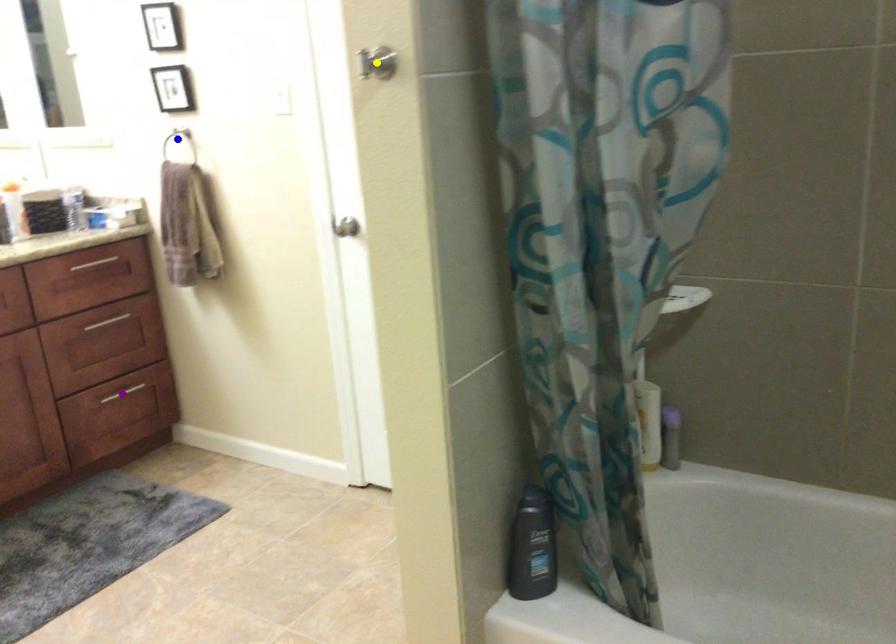
Order these from farthest to nearest:
A) purple point
B) blue point
C) yellow point

purple point < blue point < yellow point